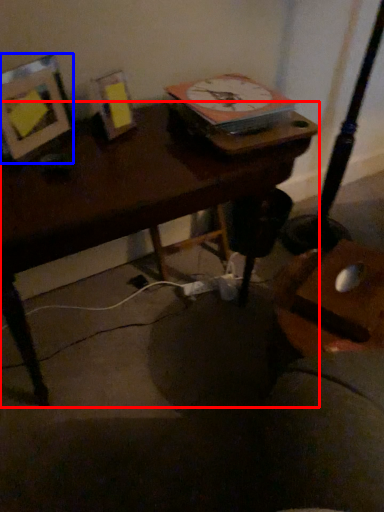
Question: Which point is closer to the camera, desk (highlighted by a red box) or picture frame (highlighted by a blue box)?

Choices:
 (A) desk
 (B) picture frame

Answer: (A)